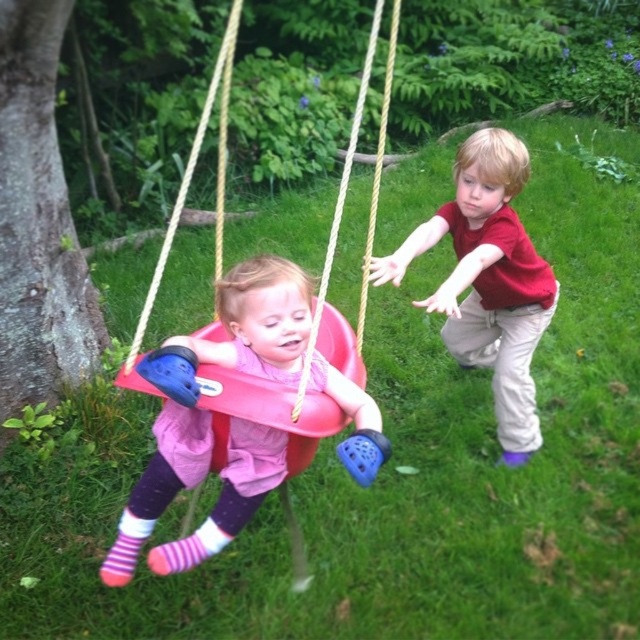
You are a parent observing the two swings in the image. The matte pink swing seat at center and the pink plastic swing at center. Which one is lower to the ground?

The matte pink swing seat at center is lower to the ground compared to the pink plastic swing at center because it has a lesser height.

You are a parent observing the scene. You notice the matte red shirt at right and the pink plastic swing at center. Which object is shorter in height?

The matte red shirt at right has a lesser height compared to the pink plastic swing at center, so the matte red shirt at right is shorter.